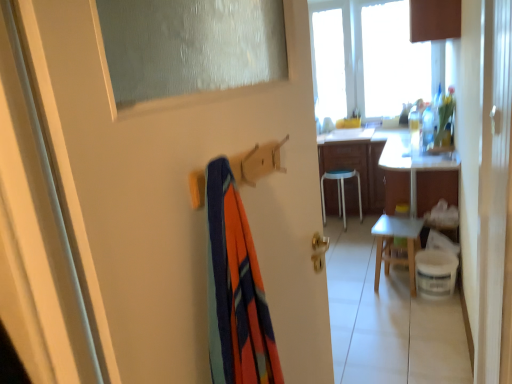
Find the location of a particular element. The image size is (512, 384). free spot behind wooden chair at center is located at coordinates (388, 270).